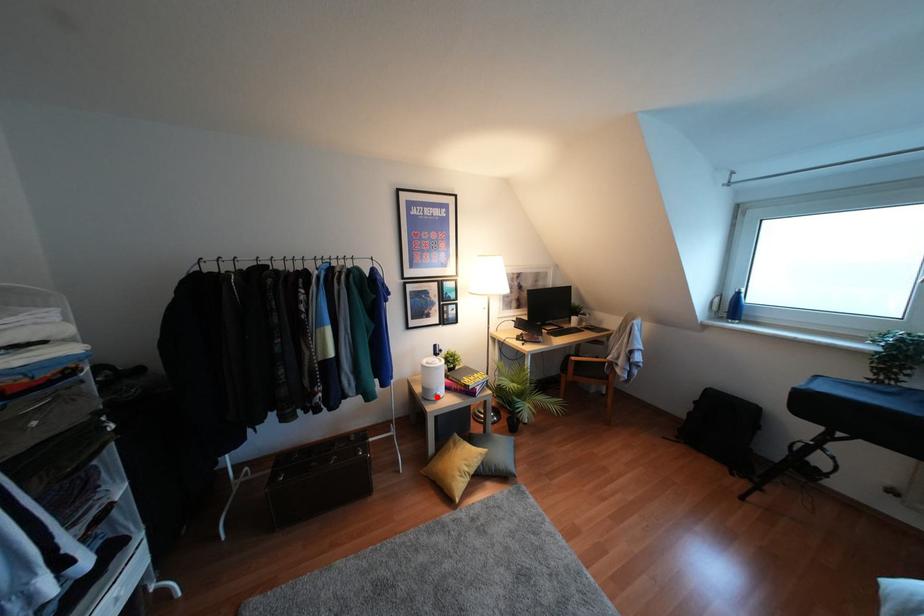
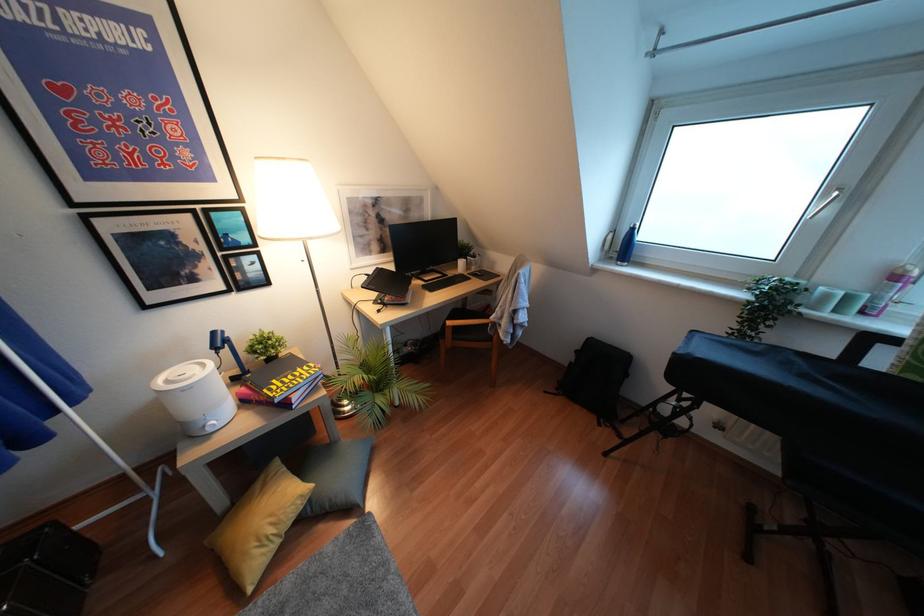
Where in the second image is the point corresponding to the highlighted location from the first image?

(210, 430)